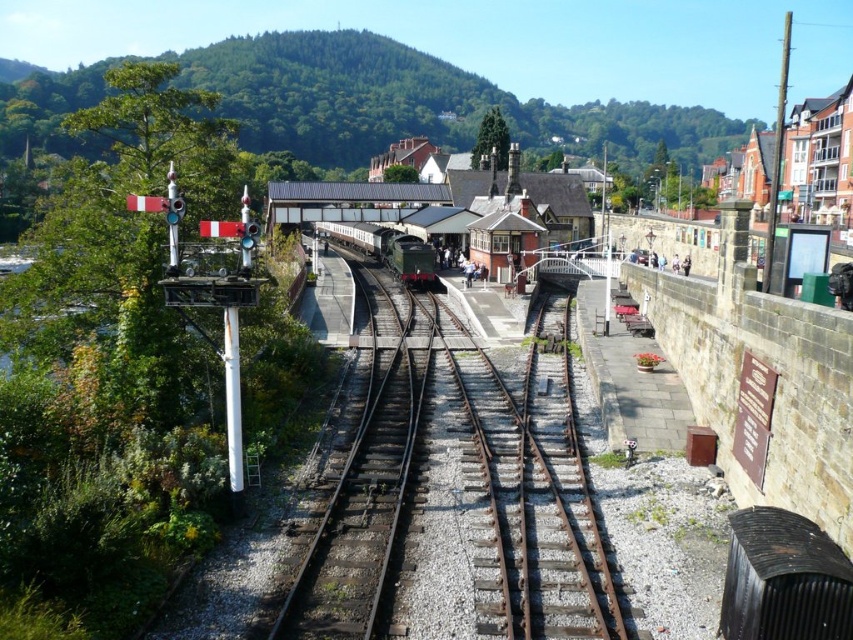
Question: Which of the following is the farthest from the observer?

Choices:
 (A) (576, 570)
 (B) (418, 241)

Answer: (B)

Question: Is rusty metal tracks at center smaller than green polished wood train at center?

Choices:
 (A) yes
 (B) no

Answer: (A)

Question: Can you confirm if rusty metal tracks at center is bigger than green polished wood train at center?

Choices:
 (A) yes
 (B) no

Answer: (B)

Question: Is rusty metal tracks at center below green polished wood train at center?

Choices:
 (A) no
 (B) yes

Answer: (B)

Question: Which object appears closest to the camera in this image?

Choices:
 (A) green polished wood train at center
 (B) rusty metal tracks at center

Answer: (B)